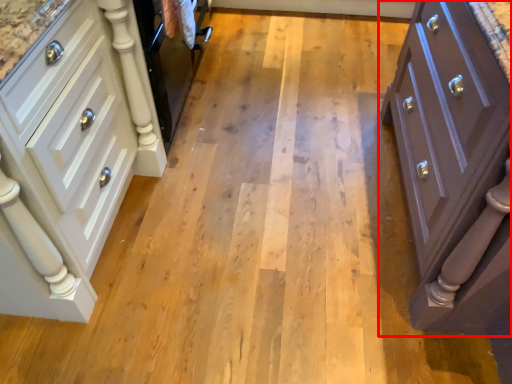
Question: From the image, what is the correct spatial relationship of chest of drawers (annotated by the red box) in relation to chest of drawers?

Choices:
 (A) right
 (B) left

Answer: (A)